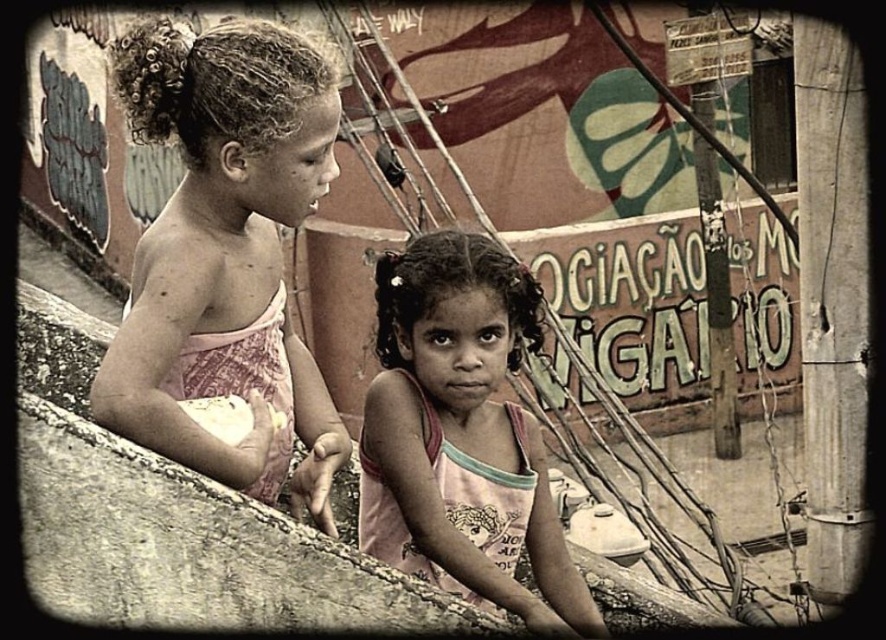
You are a fashion designer observing two children in an urban setting. You notice the pink fabric dress at upper left and the pink fabric shirt at center. Which clothing item appears taller in the image?

The pink fabric dress at upper left is much taller than the pink fabric shirt at center.

You are a photographer trying to capture both the pink fabric dress at upper left and the pink fabric shirt at center in the same frame. Which clothing item is located more to the left side?

The pink fabric dress at upper left is more to the left side than the pink fabric shirt at center.